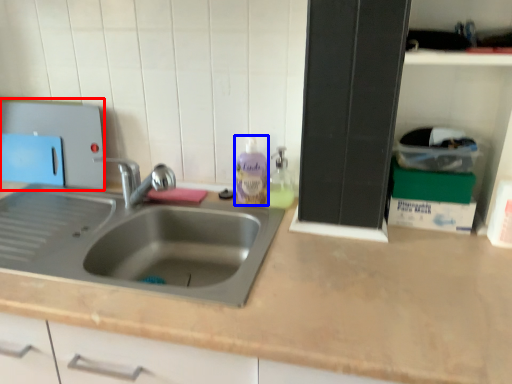
Question: Among these objects, which one is farthest to the camera, appliance (highlighted by a red box) or cleaning product (highlighted by a blue box)?

Choices:
 (A) appliance
 (B) cleaning product

Answer: (A)